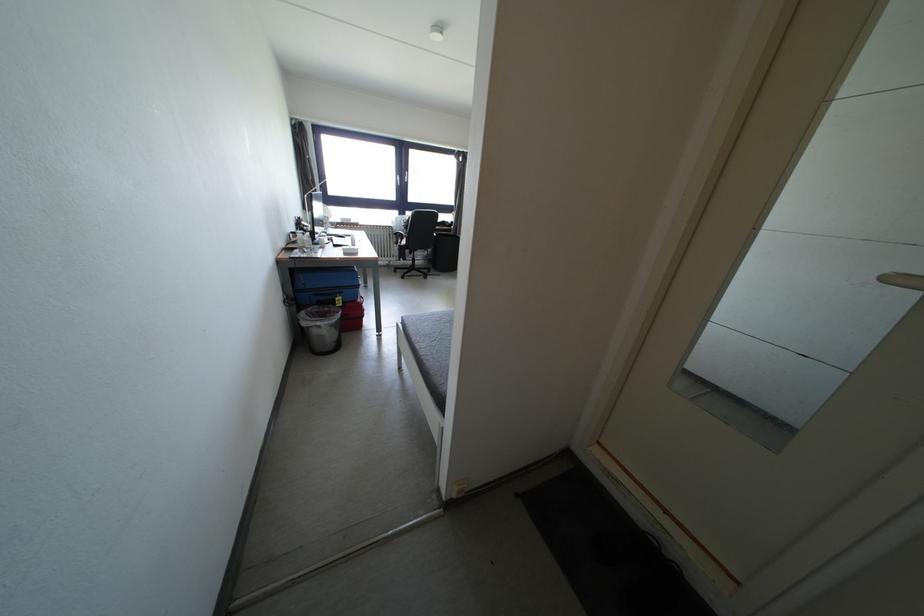
Where is `chair armrest`? The image size is (924, 616). chair armrest is located at coordinates (403, 232).